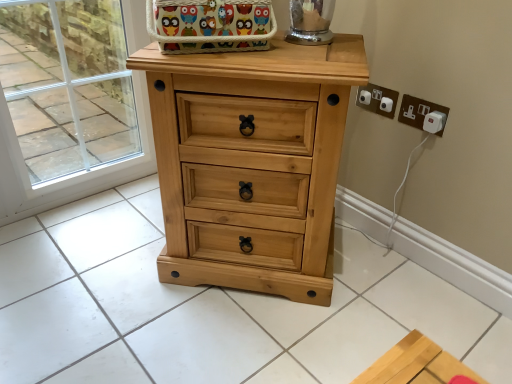
Question: Can you confirm if white plastic electrical outlet at upper right, which is the first electric outlet in left-to-right order, is smaller than transparent glass door at upper left?

Choices:
 (A) no
 (B) yes

Answer: (B)

Question: Is white plastic electrical outlet at upper right, which is the first electric outlet in left-to-right order, at the right side of transparent glass door at upper left?

Choices:
 (A) no
 (B) yes

Answer: (B)

Question: Is white plastic electrical outlet at upper right, placed as the second electric outlet when sorted from right to left, oriented towards transparent glass door at upper left?

Choices:
 (A) yes
 (B) no

Answer: (B)

Question: Would you say white plastic electrical outlet at upper right, placed as the second electric outlet when sorted from right to left, is outside transparent glass door at upper left?

Choices:
 (A) yes
 (B) no

Answer: (A)

Question: Is transparent glass door at upper left at the back of white plastic electrical outlet at upper right, placed as the second electric outlet when sorted from right to left?

Choices:
 (A) yes
 (B) no

Answer: (B)

Question: Based on their positions, is white plastic plug at upper right, which appears as the 1th electric outlet when viewed from the right, located to the left or right of light wood chest of drawers at center?

Choices:
 (A) left
 (B) right

Answer: (B)

Question: From the image's perspective, is white plastic plug at upper right, positioned as the 2th electric outlet in left-to-right order, above or below light wood chest of drawers at center?

Choices:
 (A) below
 (B) above

Answer: (B)

Question: In terms of width, does white plastic plug at upper right, which appears as the 1th electric outlet when viewed from the right, look wider or thinner when compared to light wood chest of drawers at center?

Choices:
 (A) wide
 (B) thin

Answer: (B)

Question: From their relative heights in the image, would you say white plastic plug at upper right, positioned as the 2th electric outlet in left-to-right order, is taller or shorter than light wood chest of drawers at center?

Choices:
 (A) short
 (B) tall

Answer: (A)

Question: Does point (173, 82) appear closer or farther from the camera than point (436, 107)?

Choices:
 (A) closer
 (B) farther

Answer: (A)

Question: Considering the positions of light wood chest of drawers at center and white plastic plug at upper right, which appears as the 1th electric outlet when viewed from the right, in the image, is light wood chest of drawers at center bigger or smaller than white plastic plug at upper right, which appears as the 1th electric outlet when viewed from the right,?

Choices:
 (A) small
 (B) big

Answer: (B)

Question: Considering the relative positions of light wood chest of drawers at center and white plastic plug at upper right, positioned as the 2th electric outlet in left-to-right order, in the image provided, is light wood chest of drawers at center to the left or to the right of white plastic plug at upper right, positioned as the 2th electric outlet in left-to-right order,?

Choices:
 (A) left
 (B) right

Answer: (A)

Question: Is light wood chest of drawers at center in front of or behind white plastic plug at upper right, which appears as the 1th electric outlet when viewed from the right, in the image?

Choices:
 (A) front
 (B) behind

Answer: (A)

Question: Is transparent glass door at upper left situated inside light wood chest of drawers at center or outside?

Choices:
 (A) inside
 (B) outside

Answer: (B)

Question: Considering the positions of point (143, 92) and point (207, 134), is point (143, 92) closer or farther from the camera than point (207, 134)?

Choices:
 (A) closer
 (B) farther

Answer: (B)